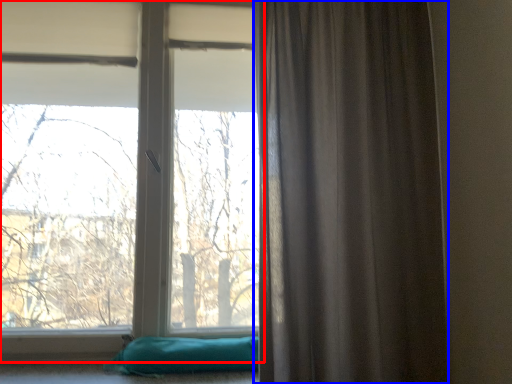
Question: Which object is closer to the camera taking this photo, window (highlighted by a red box) or curtain (highlighted by a blue box)?

Choices:
 (A) window
 (B) curtain

Answer: (B)